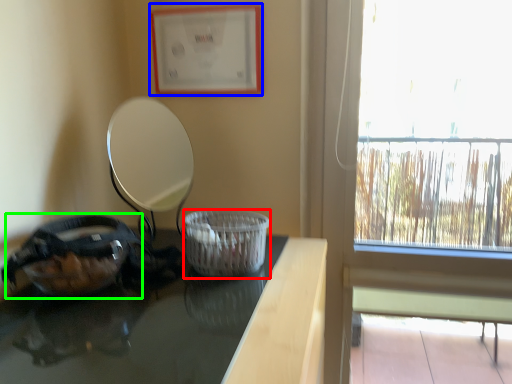
Question: Estimate the real-world distances between objects in this image. Which object is farther from basket container (highlighted by a red box), picture frame (highlighted by a blue box) or glass bowl (highlighted by a green box)?

Choices:
 (A) picture frame
 (B) glass bowl

Answer: (A)